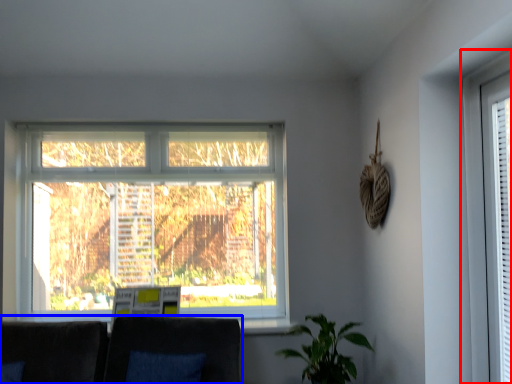
Question: Among these objects, which one is farthest to the camera, window (highlighted by a red box) or couch (highlighted by a blue box)?

Choices:
 (A) window
 (B) couch

Answer: (B)